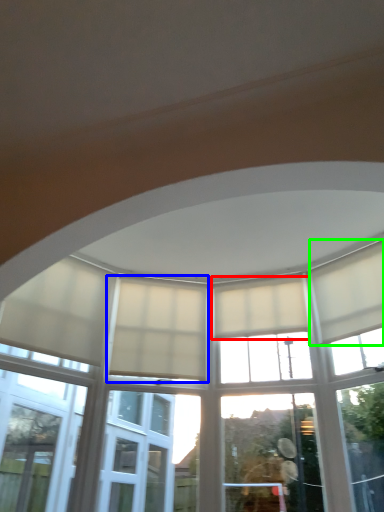
Question: Based on their relative distances, which object is farther from curtain (highlighted by a red box)? Choose from curtain (highlighted by a blue box) and curtain (highlighted by a green box).

Choices:
 (A) curtain
 (B) curtain

Answer: (A)